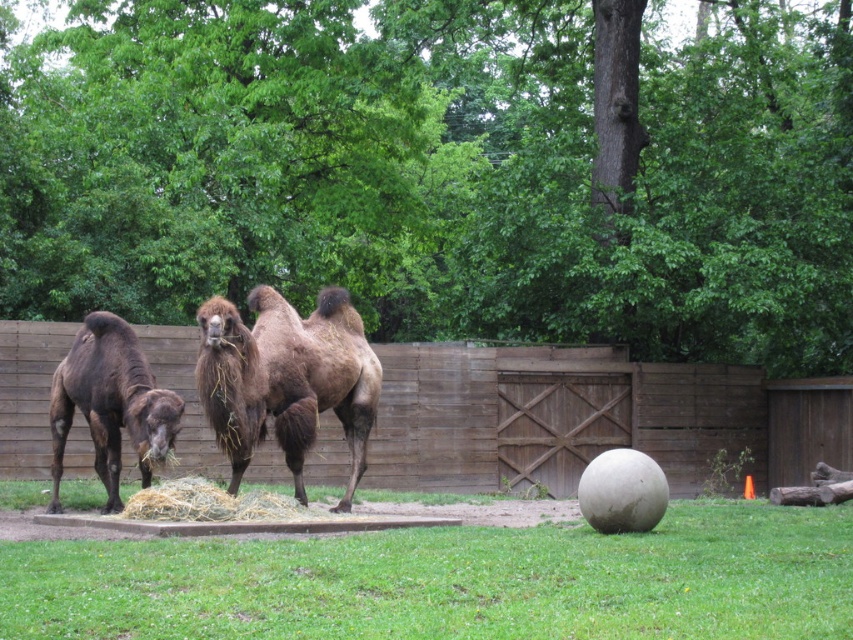
You are a zookeeper trying to clean the enclosure. You see the brown wooden fence at center and the brown fuzzy camel at center. Which object is closer to the ground?

The brown wooden fence at center is located below the brown fuzzy camel at center, so the brown wooden fence at center is closer to the ground.

In the scene shown: You are a zookeeper trying to determine the best path to walk between the brown wooden fence at center and the brown fuzzy camel at center without getting too close to either. Given that you need at least 1 meter of space between you and each object, can you safely walk between them?

The brown wooden fence at center is wider than the brown fuzzy camel at center. Since the fence is wider, there might be enough space between them to maintain the required 1 meter distance from both. However, the exact distance isn not provided, so it depends on the total width of both objects and the available space between them.

You are standing at the center of the zoo enclosure looking towards the gate. You want to place a small sign on the ground pointing towards the green grass at lower center. What coordinates should the sign be placed at?

The green grass at lower center is located at coordinates point (453,580), so the sign should be placed at those coordinates to point towards it.